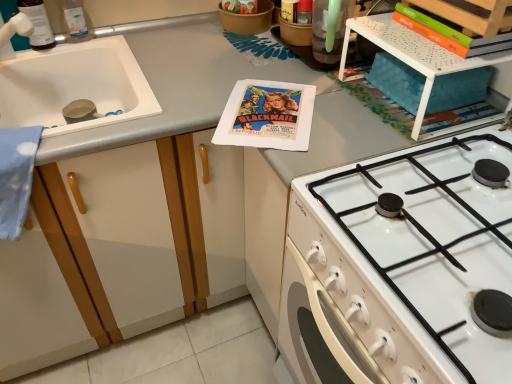
Identify the location of free space above white perforated plastic shelf at upper right (from a real-world perspective). The image size is (512, 384). (420, 39).